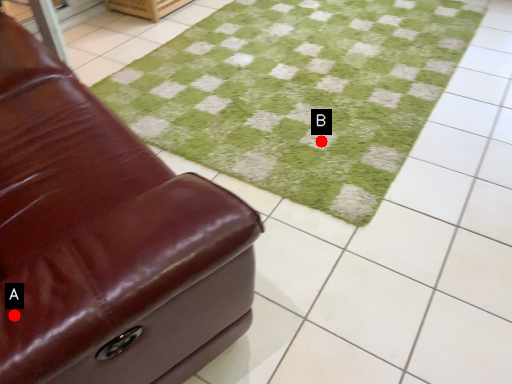
Question: Two points are circled on the image, labeled by A and B beside each circle. Which point is farther from the camera taking this photo?

Choices:
 (A) A is further
 (B) B is further

Answer: (B)